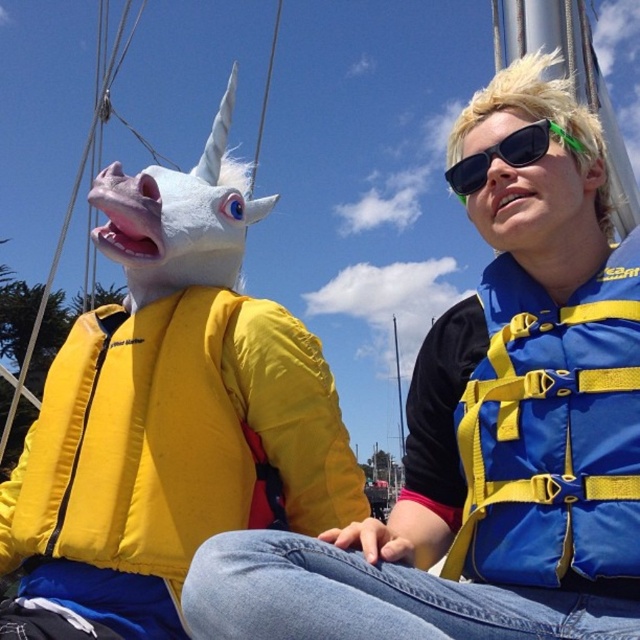
Who is higher up, yellow foam life jacket at left or sunglasses at upper right?

sunglasses at upper right is above.

Can you confirm if yellow foam life jacket at left is shorter than sunglasses at upper right?

No, yellow foam life jacket at left is not shorter than sunglasses at upper right.

Which is behind, point (97, 353) or point (502, 145)?

Positioned behind is point (97, 353).

I want to click on yellow foam life jacket at left, so click(140, 444).

Is yellow foam life jacket at left thinner than blue fabric life jacket at right?

Incorrect, yellow foam life jacket at left's width is not less than blue fabric life jacket at right's.

Is point (132, 384) positioned behind point (584, 470)?

That is True.

You are a GUI agent. You are given a task and a screenshot of the screen. Output one action in this format:
    pyautogui.click(x=<x>, y=<y>)
    Task: Click on the yellow foam life jacket at left
    
    Given the screenshot: What is the action you would take?
    pyautogui.click(x=140, y=444)

Between blue fabric life jacket at right and sunglasses at upper right, which one appears on the left side from the viewer's perspective?

sunglasses at upper right is more to the left.

Does blue fabric life jacket at right appear on the right side of sunglasses at upper right?

Yes, blue fabric life jacket at right is to the right of sunglasses at upper right.

Locate an element on the screen. The width and height of the screenshot is (640, 640). blue fabric life jacket at right is located at coordinates (552, 429).

Locate an element on the screen. blue fabric life jacket at right is located at coordinates (552, 429).